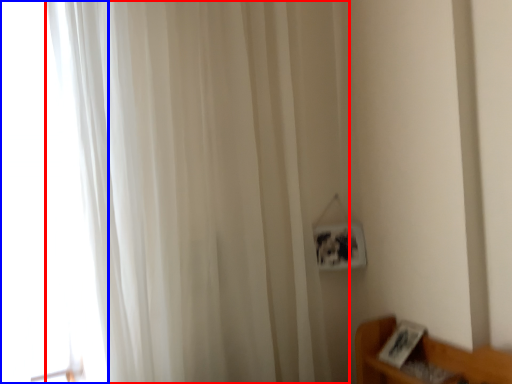
Question: Which object is closer to the camera taking this photo, curtain (highlighted by a red box) or glass door (highlighted by a blue box)?

Choices:
 (A) curtain
 (B) glass door

Answer: (A)